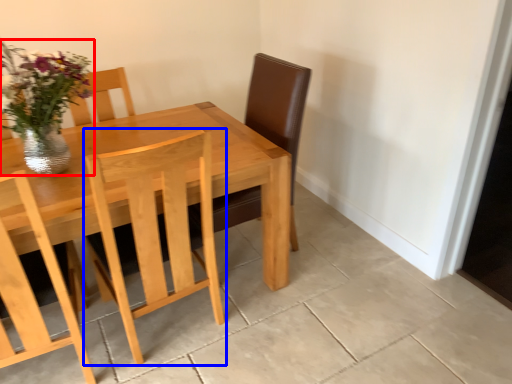
Question: Which object is closer to the camera taking this photo, floral arrangement (highlighted by a red box) or chair (highlighted by a blue box)?

Choices:
 (A) floral arrangement
 (B) chair

Answer: (B)